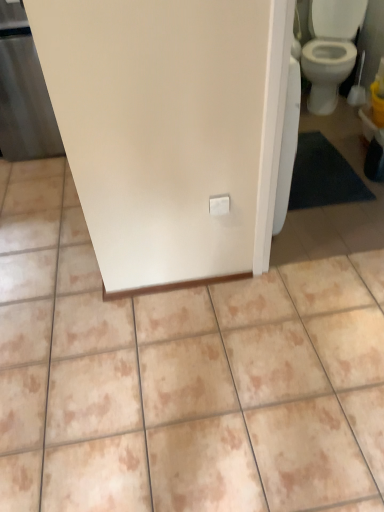
Locate an element on the screen. The image size is (384, 512). beige ceramic tile at center is located at coordinates point(183,373).

The height and width of the screenshot is (512, 384). What do you see at coordinates (183, 373) in the screenshot?
I see `beige ceramic tile at center` at bounding box center [183, 373].

Locate an element on the screen. Image resolution: width=384 pixels, height=512 pixels. matte white screen door at left is located at coordinates (23, 92).

This screenshot has height=512, width=384. Describe the element at coordinates (23, 92) in the screenshot. I see `matte white screen door at left` at that location.

Identify the location of beige ceramic tile at center. This screenshot has height=512, width=384. (183, 373).

In the image, is beige ceramic tile at center on the left side or the right side of matte white screen door at left?

Based on their positions, beige ceramic tile at center is located to the right of matte white screen door at left.

Which object is further away from the camera taking this photo, beige ceramic tile at center or matte white screen door at left?

matte white screen door at left is further away from the camera.

Does point (316, 505) appear closer or farther from the camera than point (17, 101)?

Point (316, 505) is positioned closer to the camera compared to point (17, 101).

From the image's perspective, is beige ceramic tile at center positioned above or below matte white screen door at left?

beige ceramic tile at center is situated lower than matte white screen door at left in the image.

From a real-world perspective, is beige ceramic tile at center on matte white screen door at left?

No, from a real-world perspective, beige ceramic tile at center is not over matte white screen door at left

Is beige ceramic tile at center wider or thinner than matte white screen door at left?

In the image, beige ceramic tile at center appears to be wider than matte white screen door at left.

Does beige ceramic tile at center have a lesser height compared to matte white screen door at left?

Correct, beige ceramic tile at center is not as tall as matte white screen door at left.

Is beige ceramic tile at center bigger or smaller than matte white screen door at left?

beige ceramic tile at center is bigger than matte white screen door at left.

Is matte white screen door at left a part of beige ceramic tile at center?

No, matte white screen door at left is located outside of beige ceramic tile at center.

Is beige ceramic tile at center not near matte white screen door at left?

Yes.

Is beige ceramic tile at center facing away from matte white screen door at left?

beige ceramic tile at center does not have its back to matte white screen door at left.

Image resolution: width=384 pixels, height=512 pixels. What are the coordinates of `screen door that is above the beige ceramic tile at center (from the image's perspective)` in the screenshot? It's located at (23, 92).

Considering the positions of objects matte white screen door at left and beige ceramic tile at center in the image provided, who is more to the right, matte white screen door at left or beige ceramic tile at center?

Positioned to the right is beige ceramic tile at center.

Which is behind, matte white screen door at left or beige ceramic tile at center?

matte white screen door at left is more distant.

Is point (7, 1) positioned before point (44, 211)?

Yes.

From the image's perspective, who appears lower, matte white screen door at left or beige ceramic tile at center?

beige ceramic tile at center, from the image's perspective.

From a real-world perspective, does matte white screen door at left sit lower than beige ceramic tile at center?

No, from a real-world perspective, matte white screen door at left is not beneath beige ceramic tile at center.

Considering the sizes of objects matte white screen door at left and beige ceramic tile at center in the image provided, who is thinner, matte white screen door at left or beige ceramic tile at center?

With smaller width is matte white screen door at left.

Which of these two, matte white screen door at left or beige ceramic tile at center, stands shorter?

beige ceramic tile at center is shorter.

Can you confirm if matte white screen door at left is bigger than beige ceramic tile at center?

No.

Is beige ceramic tile at center located within matte white screen door at left?

No, beige ceramic tile at center is not inside matte white screen door at left.

Is matte white screen door at left directly adjacent to beige ceramic tile at center?

No, matte white screen door at left is not beside beige ceramic tile at center.

Looking at this image, is matte white screen door at left facing away from beige ceramic tile at center?

No, matte white screen door at left's orientation is not away from beige ceramic tile at center.

What's the angular difference between matte white screen door at left and beige ceramic tile at center's facing directions?

matte white screen door at left and beige ceramic tile at center are facing 91.3 degrees away from each other.

The image size is (384, 512). In order to click on ceramic tile to the right of matte white screen door at left in this screenshot , I will do `click(183, 373)`.

Where is `ceramic tile on the right of matte white screen door at left`? This screenshot has height=512, width=384. ceramic tile on the right of matte white screen door at left is located at coordinates (183, 373).

In the image, there is a matte white screen door at left. Identify the location of ceramic tile below it (from the image's perspective). (183, 373).